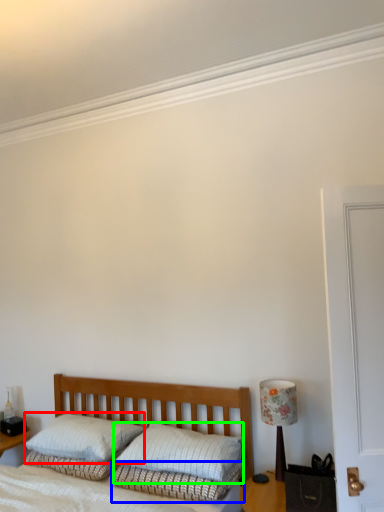
Question: Which object is the closest to the pillow (highlighted by a red box)? Choose among these: bedding (highlighted by a blue box) or pillow (highlighted by a green box).

Choices:
 (A) bedding
 (B) pillow

Answer: (B)